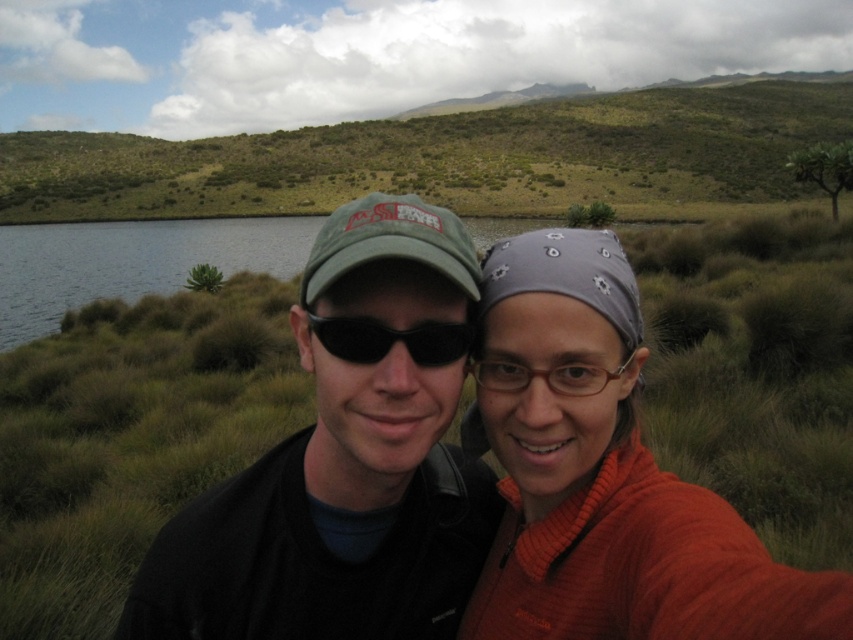
Question: Which of the following is the farthest from the observer?

Choices:
 (A) orange knitted sweater at center
 (B) green grassy hill at upper center
 (C) black plastic sunglasses at center
 (D) clear water at lake left

Answer: (B)

Question: Is green grassy hill at upper center closer to the viewer compared to black plastic sunglasses at center?

Choices:
 (A) yes
 (B) no

Answer: (B)

Question: Considering the real-world distances, which object is farthest from the clear water at lake left?

Choices:
 (A) matte green cap at center
 (B) black plastic sunglasses at center
 (C) green grassy hill at upper center
 (D) orange knitted sweater at center

Answer: (A)

Question: Does matte green cap at center lie behind black plastic sunglasses at center?

Choices:
 (A) yes
 (B) no

Answer: (B)

Question: Which of these objects is positioned closest to the black plastic sunglasses at center?

Choices:
 (A) orange knitted sweater at center
 (B) clear water at lake left
 (C) matte green cap at center

Answer: (C)

Question: Is orange knitted sweater at center below black plastic sunglasses at center?

Choices:
 (A) yes
 (B) no

Answer: (A)